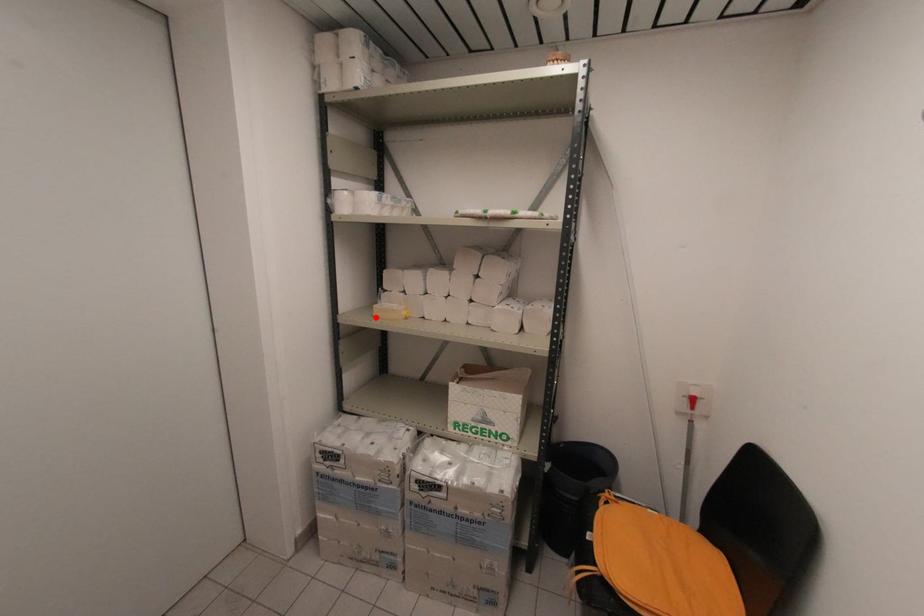
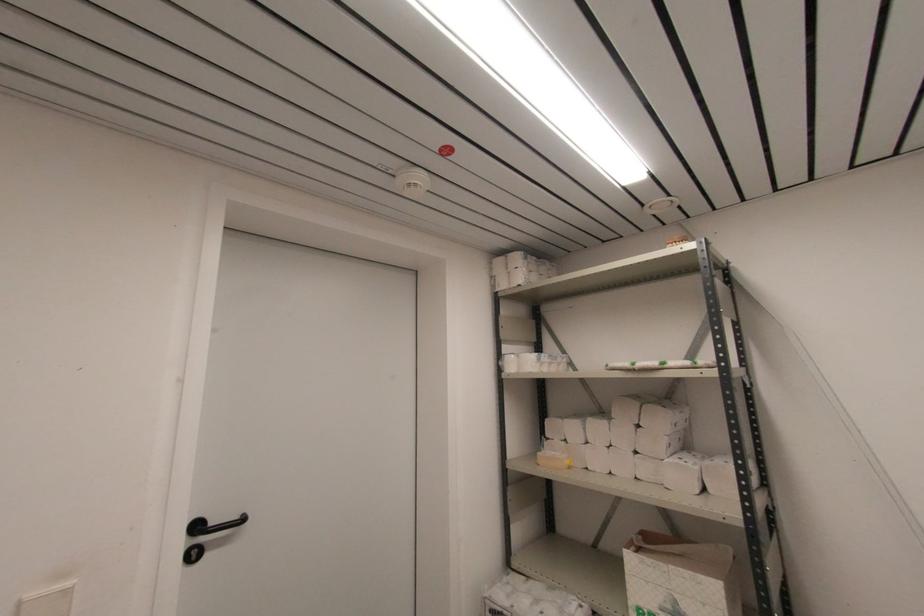
The point at the highlighted location is marked in the first image. Where is the corresponding point in the second image?

(540, 464)